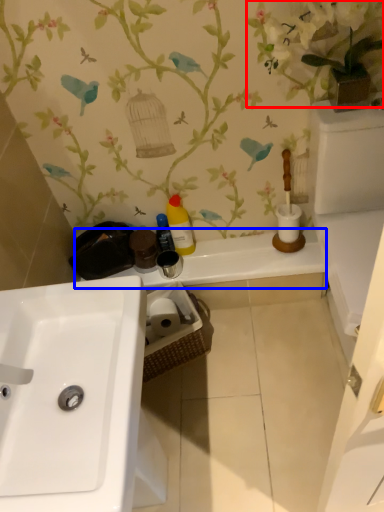
Question: Which of the following is the closest to the observer, floral arrangement (highlighted by a red box) or counter top (highlighted by a blue box)?

Choices:
 (A) floral arrangement
 (B) counter top

Answer: (A)